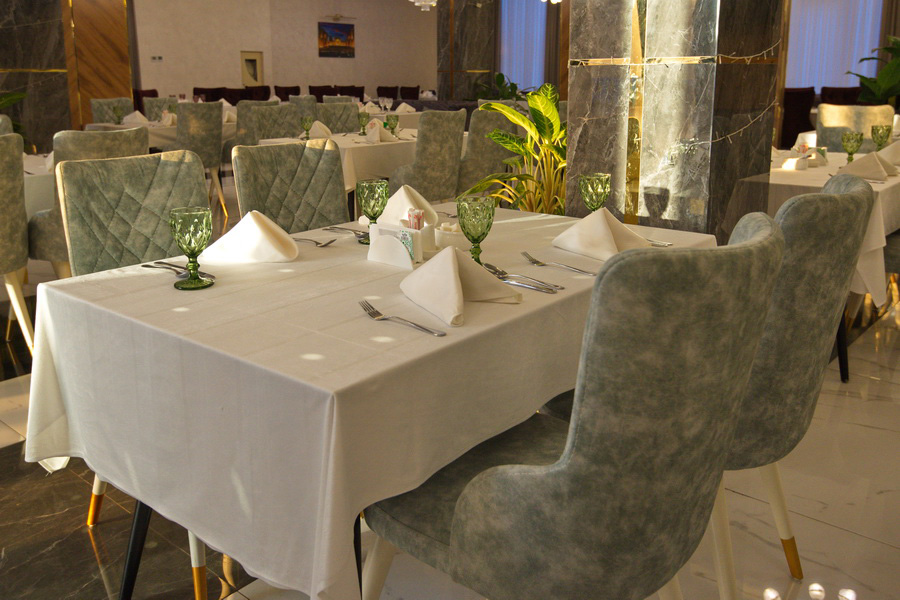
Where is `black seats`? The height and width of the screenshot is (600, 900). black seats is located at coordinates (208, 87), (144, 97), (240, 96), (258, 90), (284, 90), (311, 89), (342, 94), (357, 91), (383, 94), (415, 94).